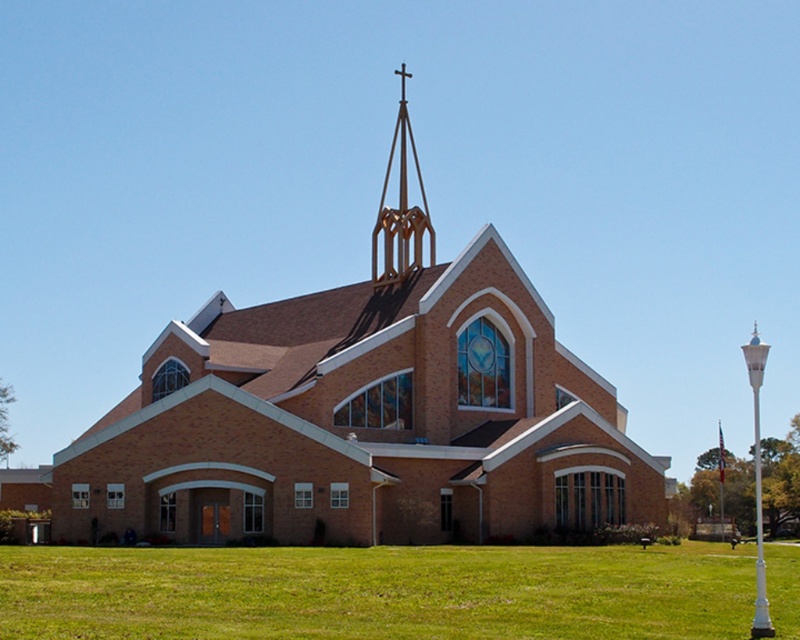
You are an architect analyzing the church design. You notice the gold metallic spire at upper center and the white glossy lamppost at right. Which of these two objects has a narrower width?

The gold metallic spire at upper center has a narrower width than the white glossy lamppost at right.

You are standing at the origin point of a coordinate system where the church is located at coordinates given in the description. If you want to walk directly towards the brown brick church at center, in which direction should you move?

You should move towards the coordinates at point 0.644 on the x axis and 0.458 on the y axis to reach the brown brick church at center.

You are standing in front of the church and notice two points marked on the building. The first point is at coordinates point (x=576, y=636) and the second is at point (x=754, y=632). Which point is closer to you?

Point (x=576, y=636) is closer to the camera than point (x=754, y=632).